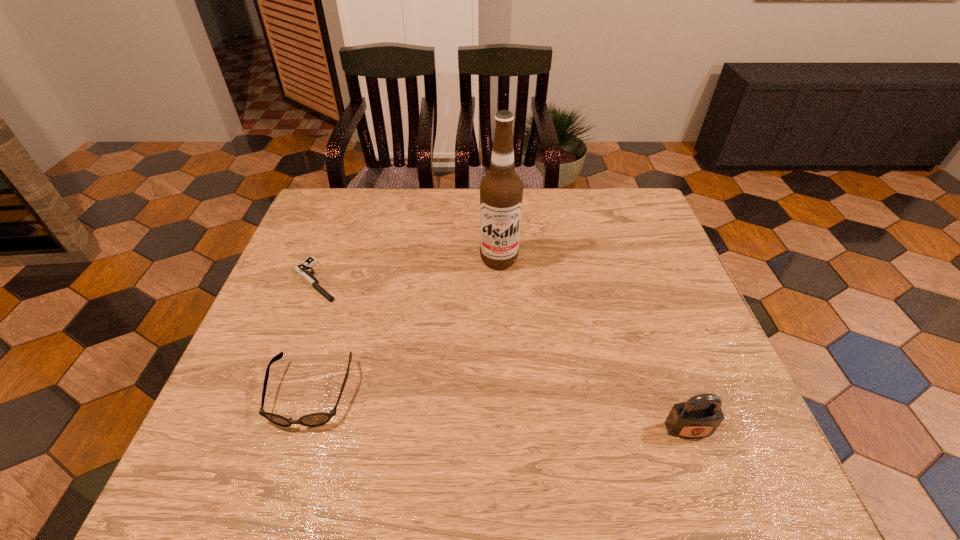
At what (x,y) coordinates should I click in order to perform the action: click on sunglasses. Please return your answer as a coordinate pair (x, y). Image resolution: width=960 pixels, height=540 pixels. Looking at the image, I should click on (314, 419).

The image size is (960, 540). Find the location of `the rightmost object`. the rightmost object is located at coordinates (700, 416).

The image size is (960, 540). I want to click on the third shortest object, so pos(700,416).

Identify the location of alcohol. Image resolution: width=960 pixels, height=540 pixels. (501, 190).

Locate an element on the screen. This screenshot has height=540, width=960. the third object from left to right is located at coordinates (501, 190).

What are the coordinates of `pistol` in the screenshot? It's located at (302, 269).

Locate an element on the screen. This screenshot has height=540, width=960. vacant space located 0.220m on the label of the tallest object is located at coordinates (504, 337).

This screenshot has width=960, height=540. Identify the location of free spot located 0.380m on the label of the tallest object. (508, 397).

Image resolution: width=960 pixels, height=540 pixels. I want to click on free point located on the label of the tallest object, so click(x=501, y=294).

This screenshot has height=540, width=960. Find the location of `vacant region located on the front-facing side of the shortest object`. vacant region located on the front-facing side of the shortest object is located at coordinates (341, 305).